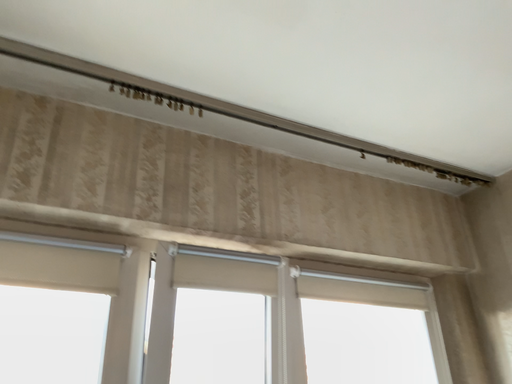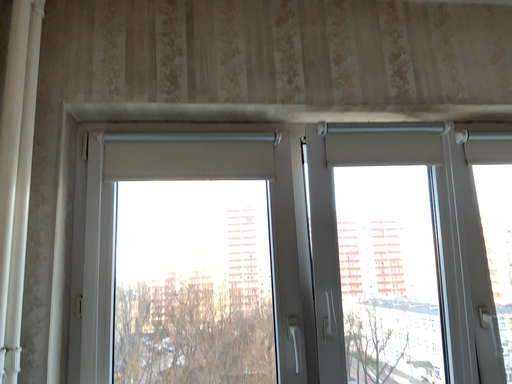
Question: How did the camera likely rotate when shooting the video?

Choices:
 (A) rotated left
 (B) rotated right

Answer: (A)